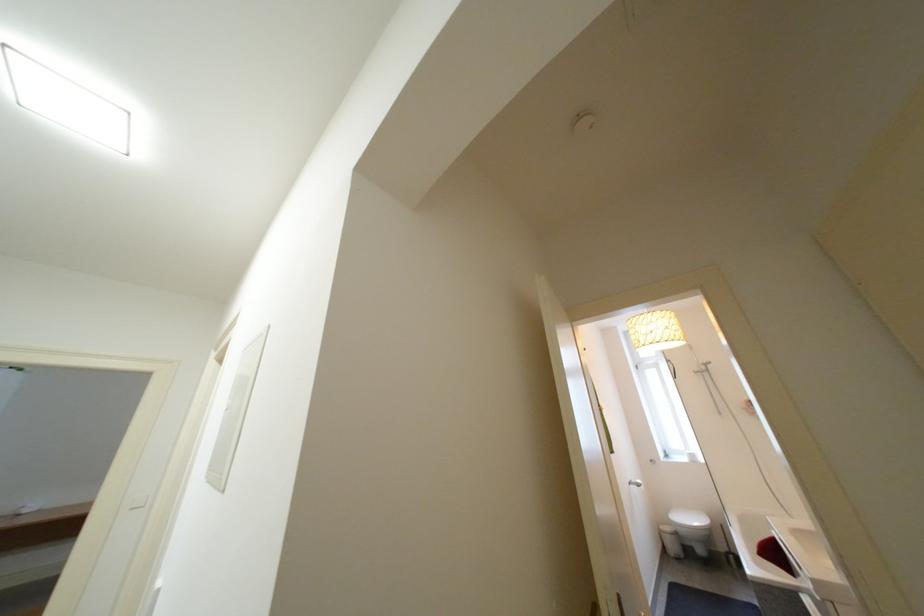
Find where to lower the white toilet lid. Please return your answer as a coordinate pair (x, y).

(688, 517)